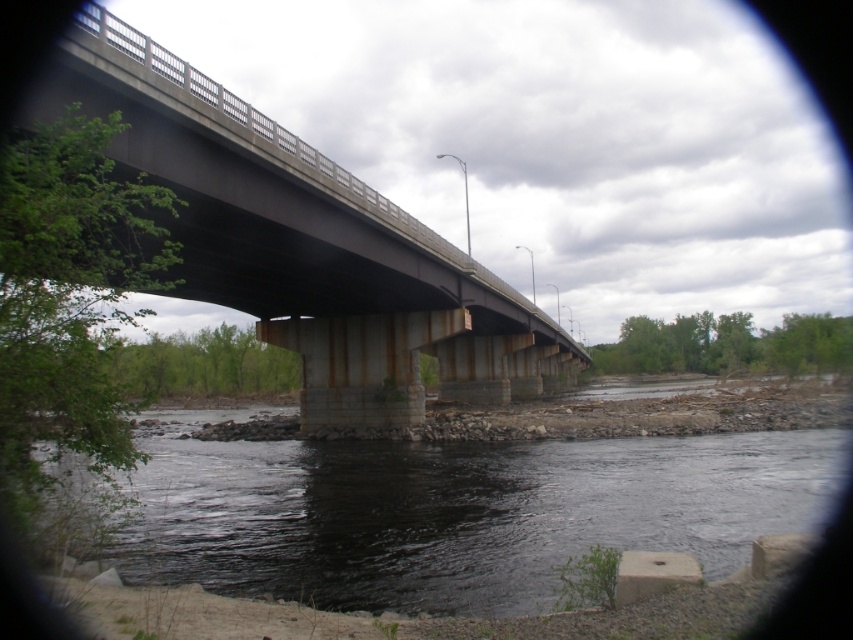
Consider the image. You are standing at the riverbank and want to cross the bridge. The bridge has a metal deck. Where is the black water at lower center located in relation to the bridge?

The black water at lower center is located at point coordinates of 0.802 in the x axis and 0.542 in the y axis.

You are a photographer standing on the riverbank and want to capture the concrete bridge at center and the black water at lower center in the same frame. Based on their positions, which object should appear closer to the bottom edge of your photo?

The black water at lower center appears closer to the bottom edge of the photo because it is positioned above the concrete bridge at center, meaning it is lower in the frame.

You are standing at the point with coordinates point (x=461, y=513) in the image. What do you see directly below you?

At point (x=461, y=513) lies black water at lower center.